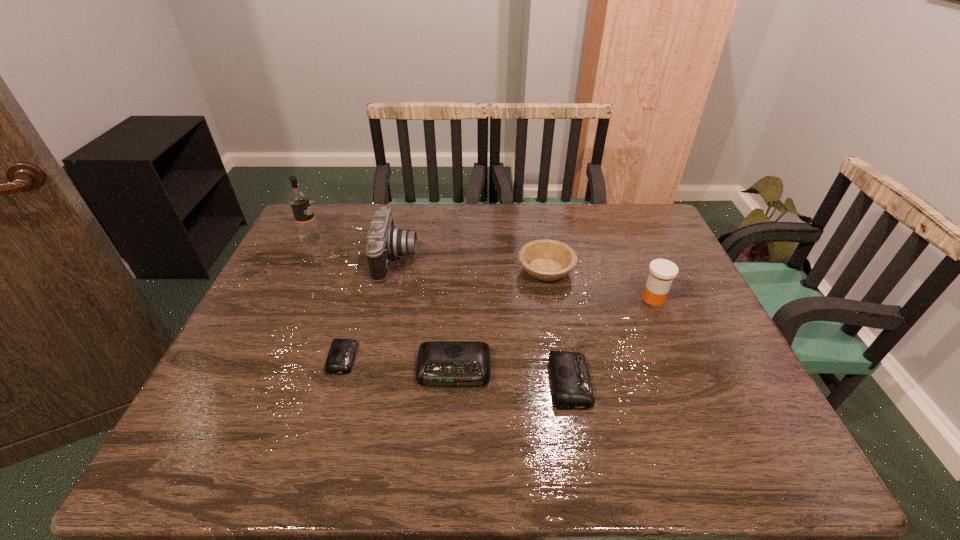
The image size is (960, 540). Identify the location of the shortest object. (342, 353).

Find the location of a particular element. the shortest alarm clock is located at coordinates (342, 353).

Locate an element on the screen. The height and width of the screenshot is (540, 960). the fourth object from right to left is located at coordinates (439, 363).

You are a GUI agent. You are given a task and a screenshot of the screen. Output one action in this format:
    pyautogui.click(x=<x>, y=<y>)
    Task: Click on the sixth tallest object
    Image resolution: width=960 pixels, height=540 pixels.
    Given the screenshot: What is the action you would take?
    pyautogui.click(x=572, y=387)

I want to click on the rightmost alarm clock, so click(572, 387).

Identify the location of the fourth shortest object. (544, 259).

Image resolution: width=960 pixels, height=540 pixels. I want to click on camera, so click(x=385, y=241).

What are the coordinates of `the tallest object` in the screenshot? It's located at 299,200.

Where is `vodka`? The height and width of the screenshot is (540, 960). vodka is located at coordinates (299, 200).

This screenshot has width=960, height=540. I want to click on medicine, so click(662, 272).